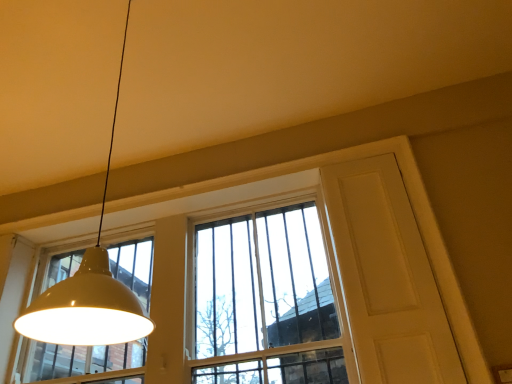
Question: Does white glossy lampshade at upper left lie behind white matte screen door at upper right?

Choices:
 (A) yes
 (B) no

Answer: (B)

Question: Would you say white glossy lampshade at upper left is outside white matte screen door at upper right?

Choices:
 (A) yes
 (B) no

Answer: (A)

Question: Can you confirm if white glossy lampshade at upper left is thinner than white matte screen door at upper right?

Choices:
 (A) yes
 (B) no

Answer: (B)

Question: From the image's perspective, is white glossy lampshade at upper left on top of white matte screen door at upper right?

Choices:
 (A) no
 (B) yes

Answer: (B)

Question: Is white glossy lampshade at upper left wider than white matte screen door at upper right?

Choices:
 (A) yes
 (B) no

Answer: (A)

Question: In the image, is white glossy lampshade at upper left positioned in front of or behind clear glass window at center?

Choices:
 (A) behind
 (B) front

Answer: (B)

Question: Is white glossy lampshade at upper left bigger or smaller than clear glass window at center?

Choices:
 (A) small
 (B) big

Answer: (A)

Question: Based on their positions, is white glossy lampshade at upper left located to the left or right of clear glass window at center?

Choices:
 (A) right
 (B) left

Answer: (A)

Question: From a real-world perspective, is white glossy lampshade at upper left above or below clear glass window at center?

Choices:
 (A) above
 (B) below

Answer: (A)

Question: Choose the correct answer: Is clear glass window at center inside white matte screen door at upper right or outside it?

Choices:
 (A) inside
 (B) outside

Answer: (B)

Question: Is clear glass window at center taller or shorter than white matte screen door at upper right?

Choices:
 (A) tall
 (B) short

Answer: (B)

Question: In terms of size, does clear glass window at center appear bigger or smaller than white matte screen door at upper right?

Choices:
 (A) small
 (B) big

Answer: (B)

Question: From the image's perspective, is clear glass window at center positioned above or below white matte screen door at upper right?

Choices:
 (A) below
 (B) above

Answer: (A)

Question: Is point (172, 203) positioned closer to the camera than point (114, 331)?

Choices:
 (A) farther
 (B) closer

Answer: (A)

Question: Based on their sizes in the image, would you say clear glass window at center is bigger or smaller than white glossy lampshade at upper left?

Choices:
 (A) small
 (B) big

Answer: (B)